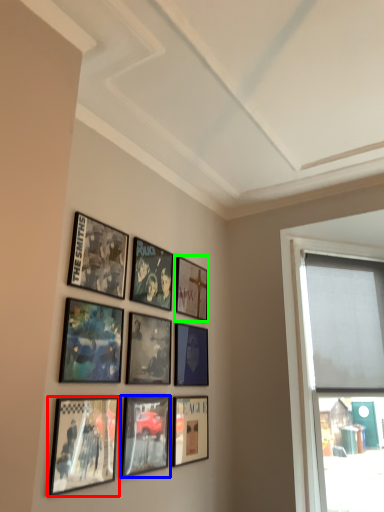
Question: Estimate the real-world distances between objects in this image. Which object is farther from picture frame (highlighted by a red box), picture frame (highlighted by a blue box) or picture frame (highlighted by a green box)?

Choices:
 (A) picture frame
 (B) picture frame

Answer: (B)